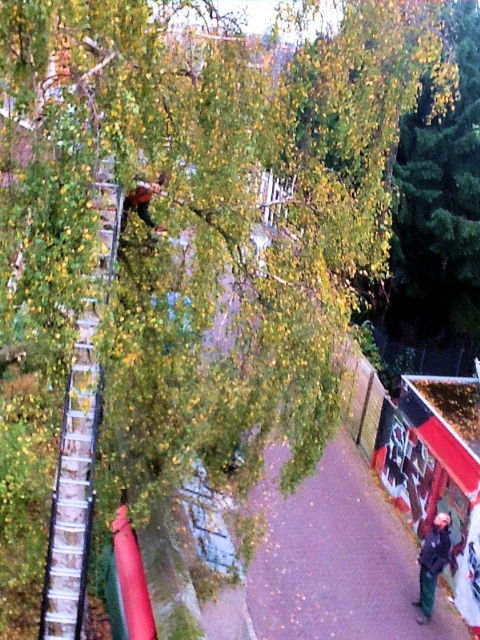
Is dark green pants at lower right to the left of metallic red skateboard at upper center from the viewer's perspective?

Incorrect, dark green pants at lower right is not on the left side of metallic red skateboard at upper center.

Locate an element on the screen. dark green pants at lower right is located at coordinates pyautogui.click(x=432, y=563).

Is metallic silver ladder at center-left positioned in front of dark green pants at lower right?

Yes.

Image resolution: width=480 pixels, height=640 pixels. Describe the element at coordinates (72, 490) in the screenshot. I see `metallic silver ladder at center-left` at that location.

At what (x,y) coordinates should I click in order to perform the action: click on metallic silver ladder at center-left. Please return your answer as a coordinate pair (x, y). The image size is (480, 640). Looking at the image, I should click on (72, 490).

Between point (58, 632) and point (157, 230), which one is positioned in front?

Positioned in front is point (58, 632).

Between metallic silver ladder at center-left and metallic red skateboard at upper center, which one appears on the left side from the viewer's perspective?

metallic silver ladder at center-left

Where is `metallic silver ladder at center-left`? This screenshot has height=640, width=480. metallic silver ladder at center-left is located at coordinates (72, 490).